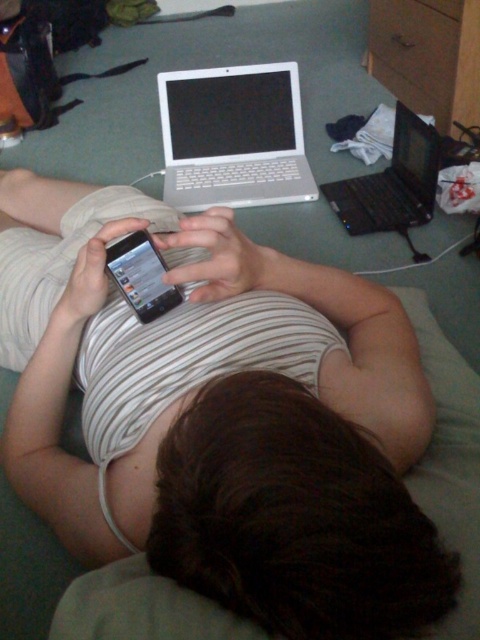
You are trying to place a tall plant on the wooden dresser at upper center and the black plastic laptop at upper right. Which surface can better accommodate the height of the plant?

The wooden dresser at upper center is much taller than the black plastic laptop at upper right, so it can better accommodate the height of the plant.

You are a delivery robot trying to place a package on the surface where the person is lying. The package must be placed at the exact coordinates of point [233,138]. However, there is an object at that location. What object is blocking the delivery robot from placing the package there?

The silver metallic laptop at upper center is blocking the delivery robot from placing the package at point [233,138] because the point indicates the location of the silver metallic laptop at upper center.